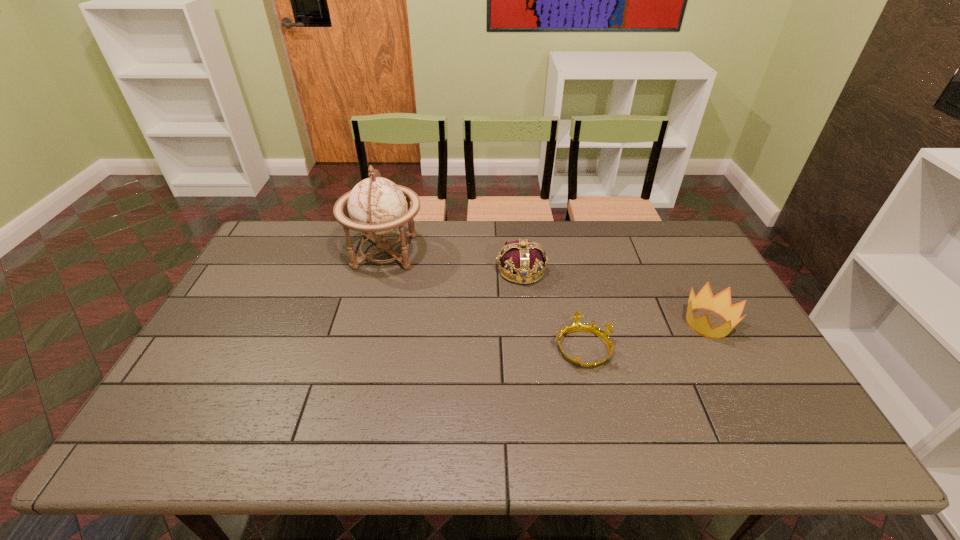
The height and width of the screenshot is (540, 960). What are the coordinates of `vacant region that satisfies the following two spatial constraints: 1. at the front of the tallest object showing Africa; 2. on the left side of the shortest crown` in the screenshot? It's located at (360, 348).